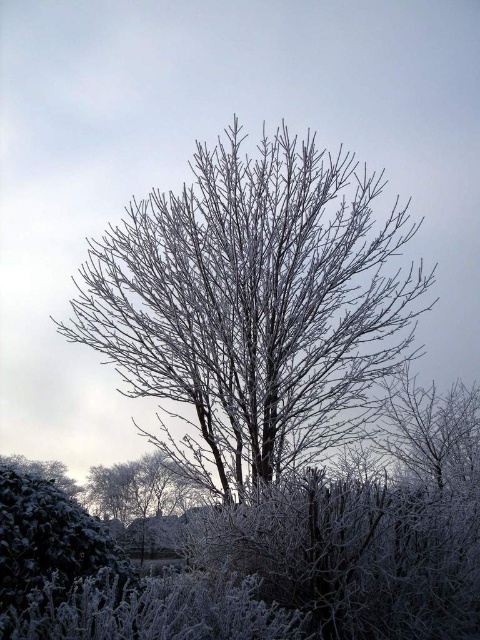
Does frosted branches at center have a lesser height compared to green matte bush at lower left?

Incorrect, frosted branches at center's height does not fall short of green matte bush at lower left's.

Is frosted branches at center wider than green matte bush at lower left?

Yes, frosted branches at center is wider than green matte bush at lower left.

Who is more distant from viewer, [408,237] or [45,504]?

The point [408,237] is more distant.

At what (x,y) coordinates should I click in order to perform the action: click on frosted branches at center. Please return your answer as a coordinate pair (x, y). Looking at the image, I should click on (253, 305).